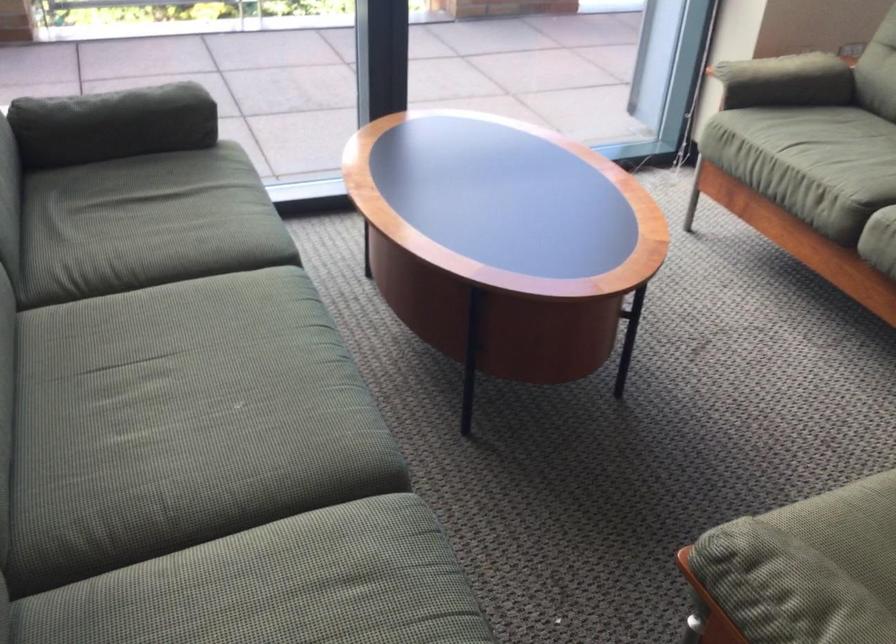
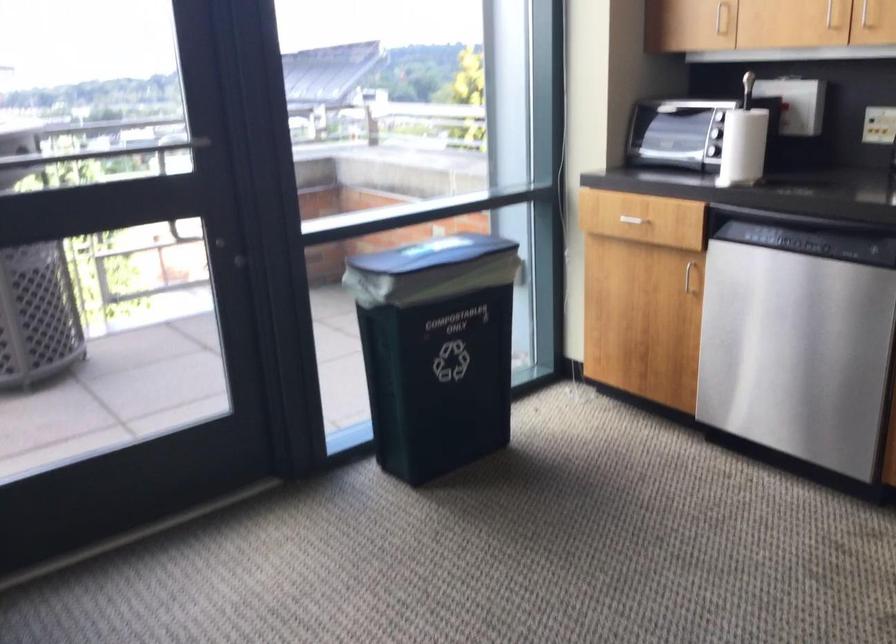
What movement of the cameraman would produce the second image?

The cameraman moved toward right, forward.